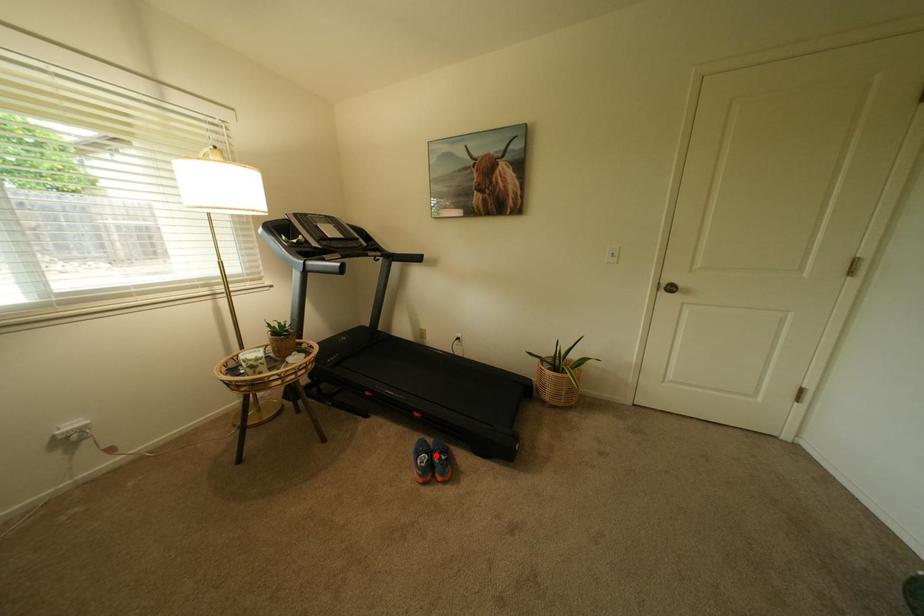
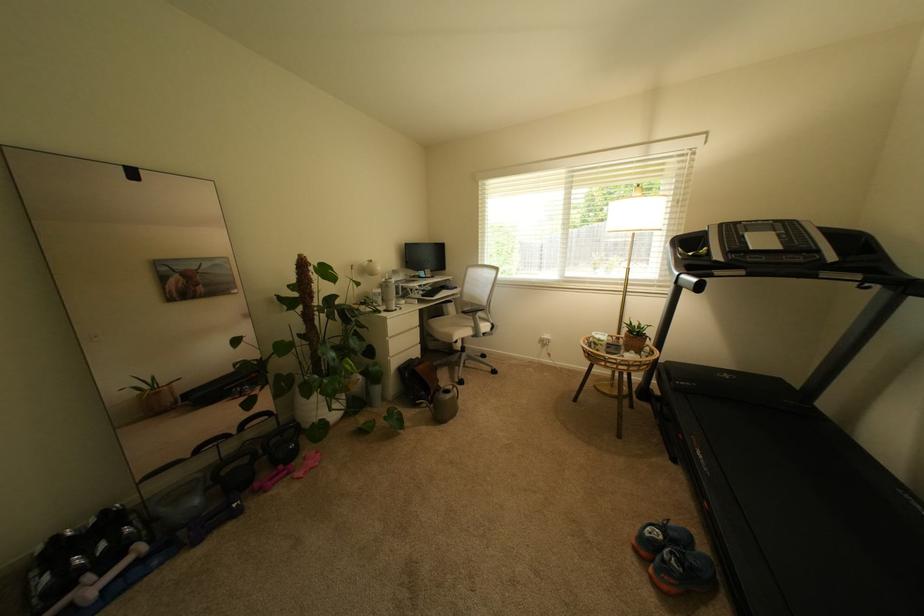
Question: A red point is marked in image1. In image2, is the corresponding 3D point closer to the camera or farther? Reply with the corresponding letter.

Choices:
 (A) The corresponding 3D point is closer.
 (B) The corresponding 3D point is farther.

Answer: (B)